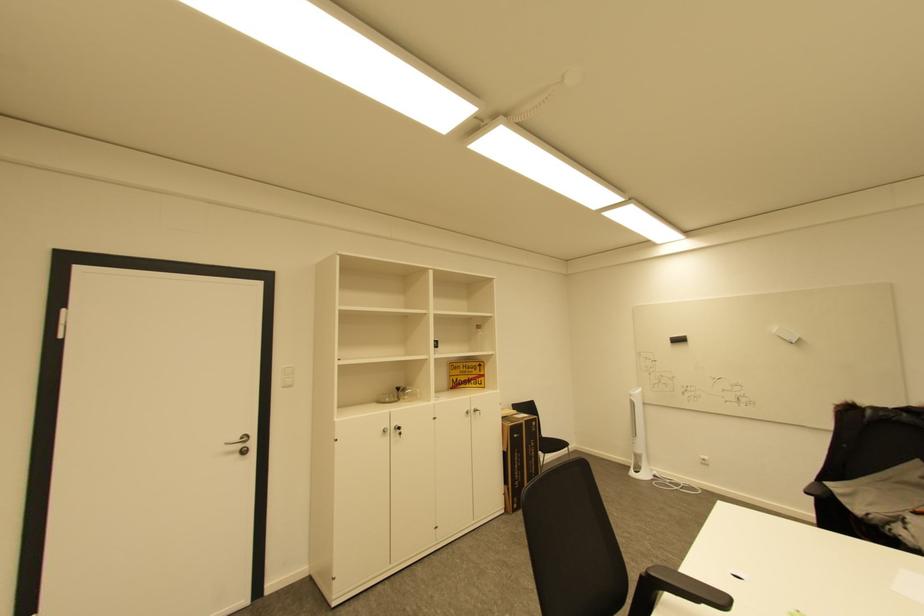
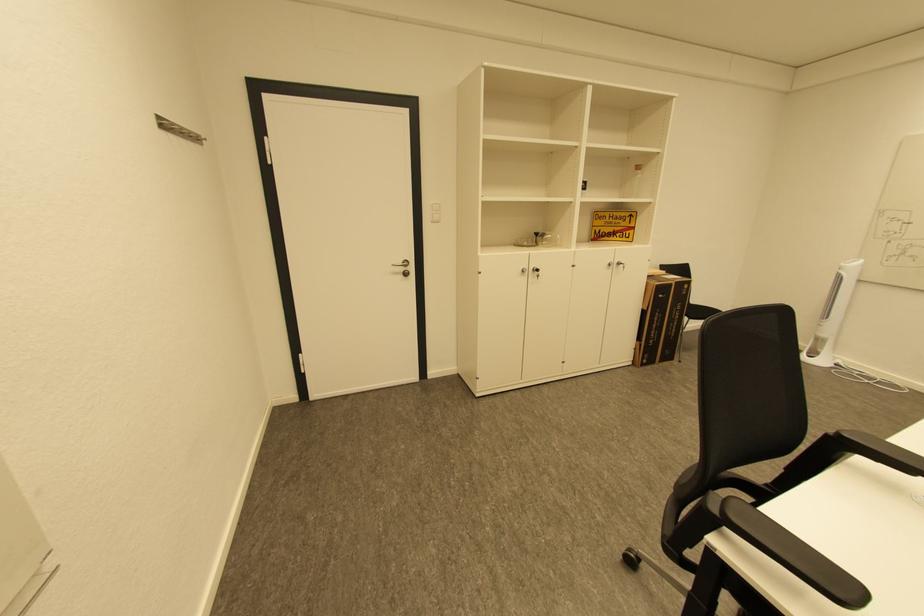
In the second image, find the point that corresponds to the point at 654,576 in the first image.

(845, 436)